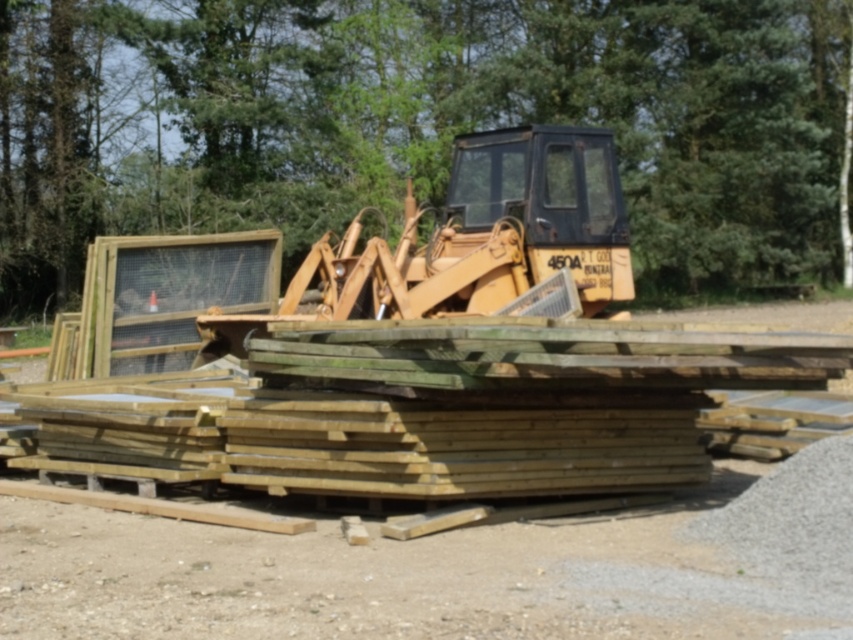
Is green leafy tree at upper center behind yellow metallic tractor at center?

Yes, green leafy tree at upper center is behind yellow metallic tractor at center.

Where is `green leafy tree at upper center`? This screenshot has height=640, width=853. green leafy tree at upper center is located at coordinates (419, 122).

This screenshot has width=853, height=640. Find the location of `green leafy tree at upper center`. green leafy tree at upper center is located at coordinates (419, 122).